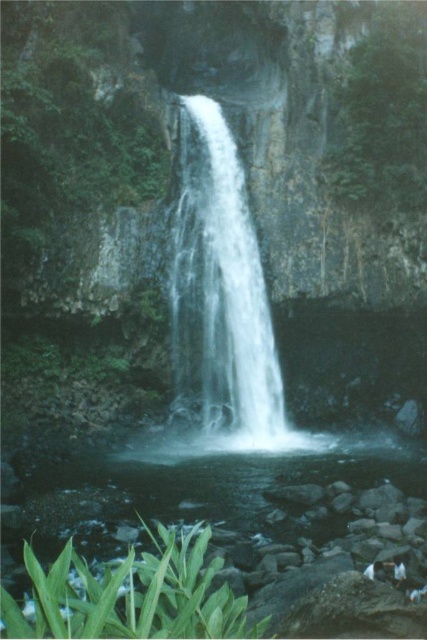
Question: Is white smooth waterfall at center bigger than green leafy plant at lower left?

Choices:
 (A) yes
 (B) no

Answer: (B)

Question: Where is green leafy plant at lower left located in relation to green leafy plant at upper right in the image?

Choices:
 (A) above
 (B) below

Answer: (B)

Question: Which point is closer to the camera taking this photo?

Choices:
 (A) (172, 547)
 (B) (256, 333)
 (C) (350, 97)

Answer: (A)

Question: Which point is farther to the camera?

Choices:
 (A) click(x=253, y=241)
 (B) click(x=350, y=202)

Answer: (B)

Question: Can you confirm if white smooth waterfall at center is positioned above green leafy plant at upper right?

Choices:
 (A) no
 (B) yes

Answer: (A)

Question: Among these points, which one is nearest to the camera?

Choices:
 (A) (412, 202)
 (B) (17, 620)
 (C) (219, 188)

Answer: (B)